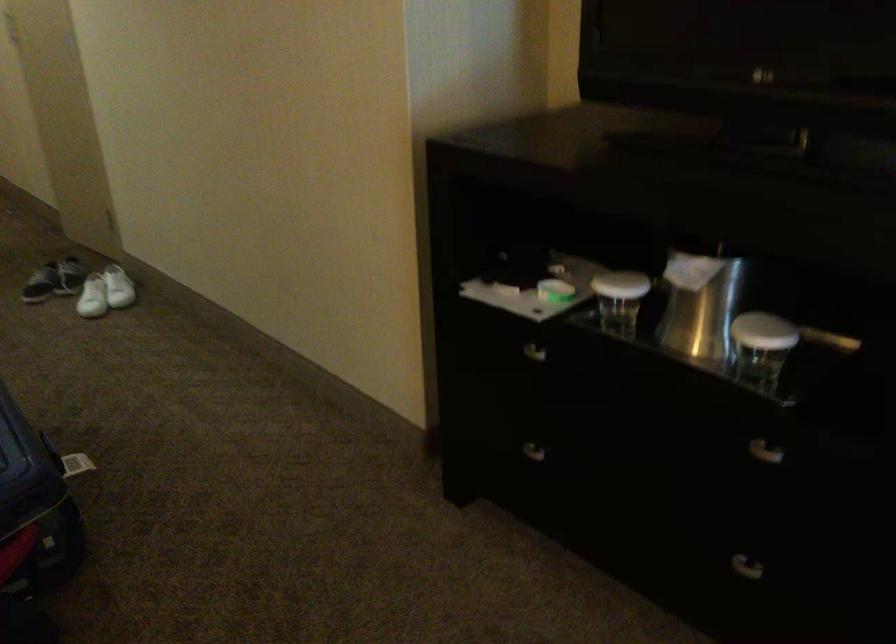
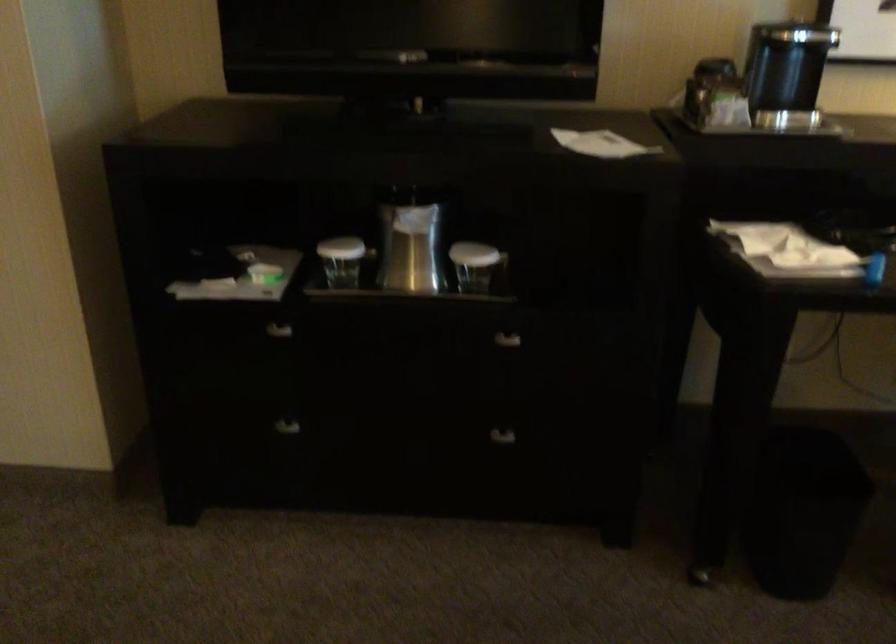
Where in the second image is the point corresponding to point 768,545 from the first image?

(495, 426)